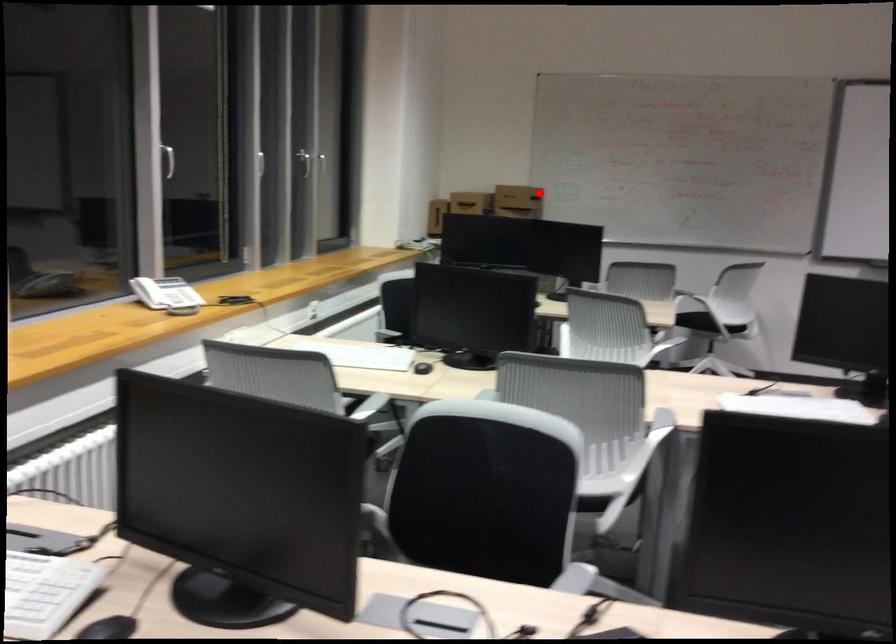
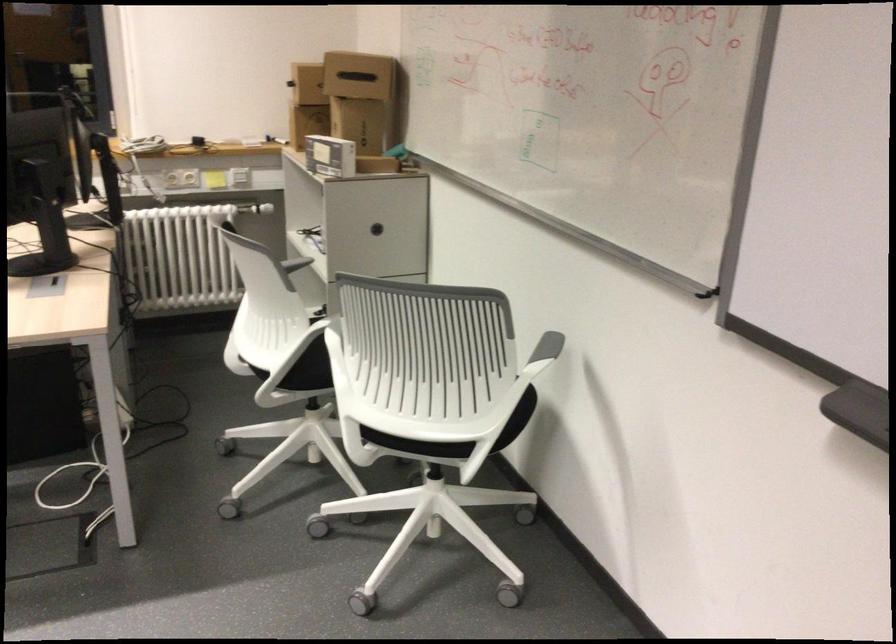
The point at the highlighted location is marked in the first image. Where is the corresponding point in the second image?

(357, 76)